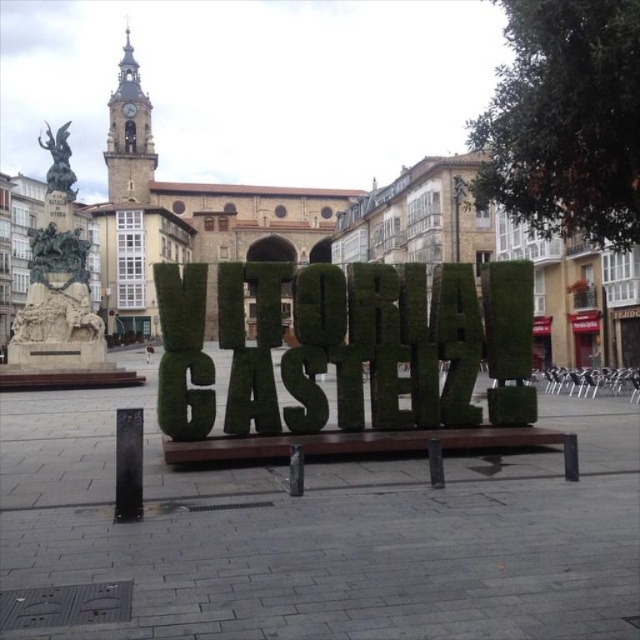
Is green mossy letter at center closer to camera compared to green grass sign at center?

No, it is not.

What are the coordinates of `green mossy letter at center` in the screenshot? It's located at (385, 346).

Find the location of a particular element. Image resolution: width=640 pixels, height=640 pixels. green mossy letter at center is located at coordinates (385, 346).

Locate an element on the screen. Image resolution: width=640 pixels, height=640 pixels. green mossy letter at center is located at coordinates (385, 346).